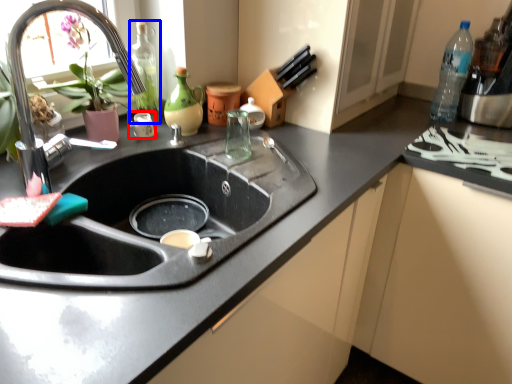
Question: Which object appears closest to the camera in this image, appliance (highlighted by a red box) or bottle (highlighted by a blue box)?

Choices:
 (A) appliance
 (B) bottle

Answer: (B)